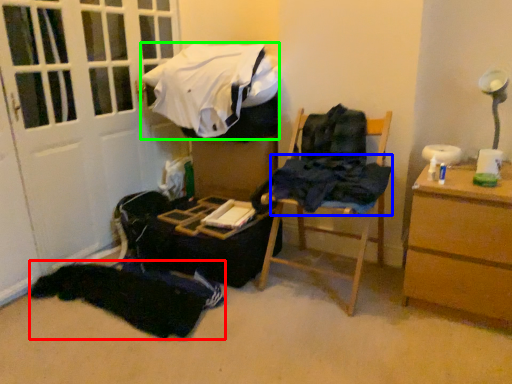
Question: Which object is positioned closest to clothing (highlighted by a red box)? Select from clothing (highlighted by a blue box) and clothing (highlighted by a green box).

Choices:
 (A) clothing
 (B) clothing

Answer: (A)